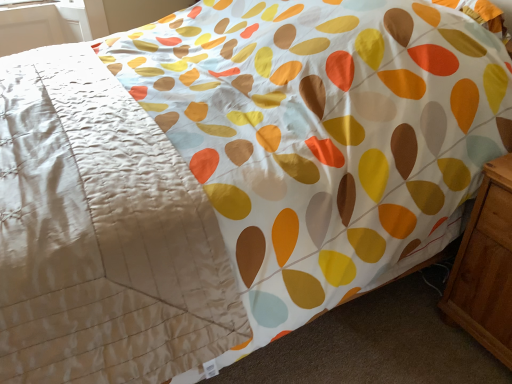
Question: In terms of width, does light brown wood at right look wider or thinner when compared to silky beige blanket at upper left?

Choices:
 (A) wide
 (B) thin

Answer: (B)

Question: From the image's perspective, is light brown wood at right located above or below silky beige blanket at upper left?

Choices:
 (A) below
 (B) above

Answer: (A)

Question: From a real-world perspective, is light brown wood at right physically located above or below silky beige blanket at upper left?

Choices:
 (A) below
 (B) above

Answer: (A)

Question: Is point (6, 122) closer or farther from the camera than point (483, 309)?

Choices:
 (A) farther
 (B) closer

Answer: (A)

Question: Considering the positions of silky beige blanket at upper left and light brown wood at right in the image, is silky beige blanket at upper left bigger or smaller than light brown wood at right?

Choices:
 (A) big
 (B) small

Answer: (A)

Question: Considering their positions, is silky beige blanket at upper left located in front of or behind light brown wood at right?

Choices:
 (A) behind
 (B) front

Answer: (B)

Question: Is silky beige blanket at upper left situated inside light brown wood at right or outside?

Choices:
 (A) outside
 (B) inside

Answer: (A)